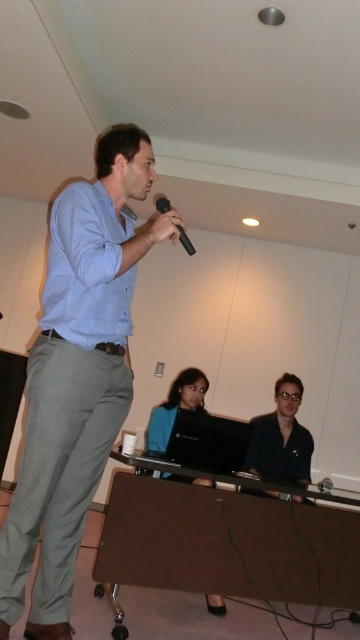
Question: Which of the following is the farthest from the observer?

Choices:
 (A) blue fabric shirt at center
 (B) black matte microphone at center

Answer: (A)

Question: Which object is the farthest from the black glossy shirt at center?

Choices:
 (A) blue fabric shirt at center
 (B) black matte microphone at center

Answer: (B)

Question: Is blue fabric shirt at center thinner than black matte microphone at center?

Choices:
 (A) no
 (B) yes

Answer: (A)

Question: Does matte blue shirt at center have a larger size compared to black glossy shirt at center?

Choices:
 (A) yes
 (B) no

Answer: (A)

Question: Which object is the closest to the matte blue shirt at center?

Choices:
 (A) black glossy shirt at center
 (B) black matte microphone at center
 (C) blue fabric shirt at center

Answer: (B)

Question: Is matte blue shirt at center bigger than blue fabric shirt at center?

Choices:
 (A) no
 (B) yes

Answer: (B)